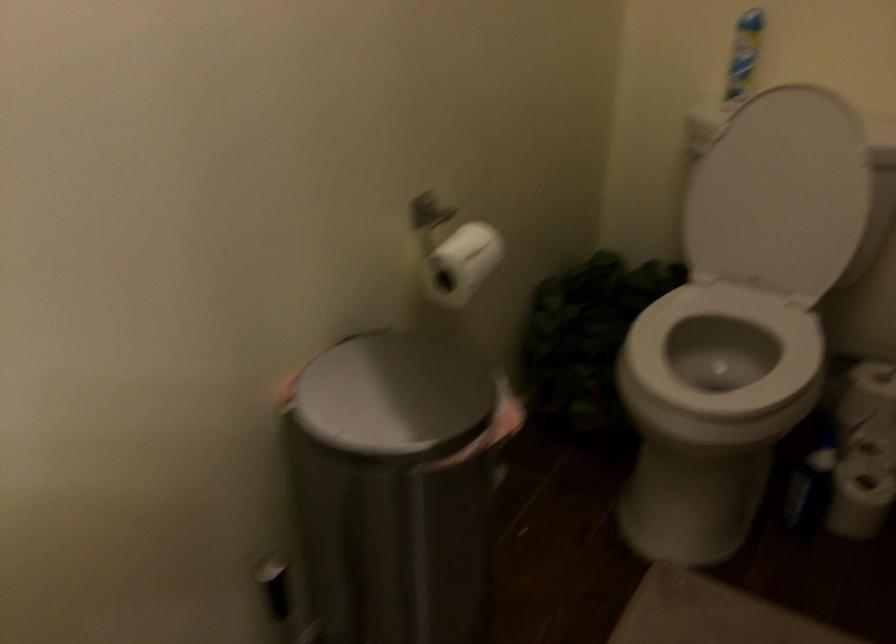
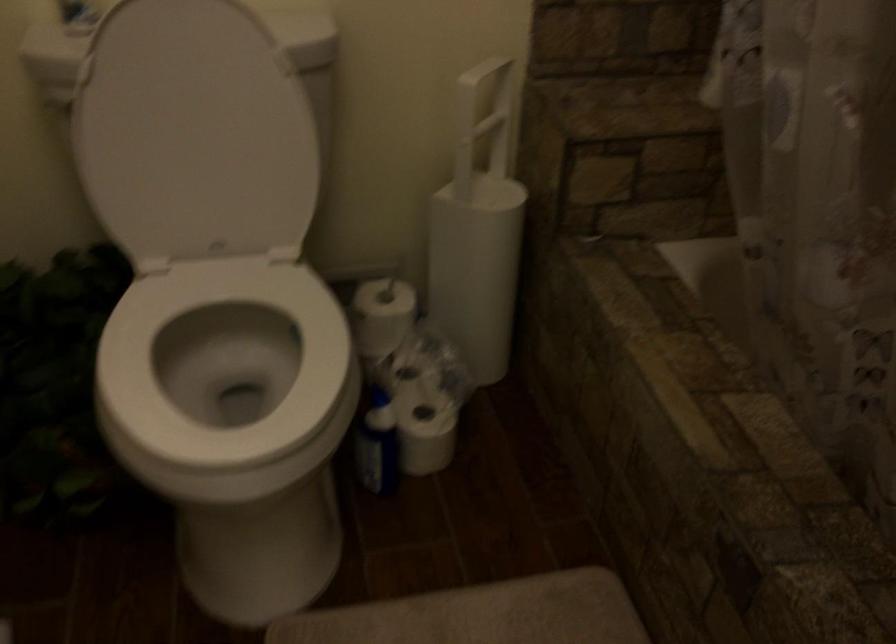
Where in the second image is the point corresponding to (x=763, y=190) from the first image?

(194, 134)